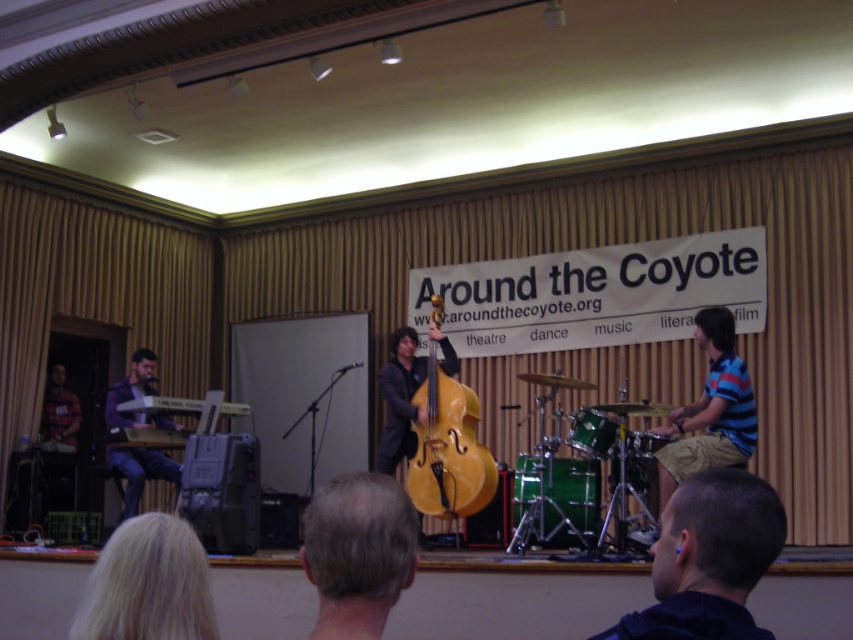
Question: Does dark blue hoodie at lower right come behind blue striped shirt at right?

Choices:
 (A) yes
 (B) no

Answer: (B)

Question: Is dark blue hoodie at lower right above blue striped shirt at right?

Choices:
 (A) no
 (B) yes

Answer: (B)

Question: Which of the following is the closest to the observer?

Choices:
 (A) matte purple keyboard at left
 (B) blue striped shirt at right
 (C) dark blue hoodie at lower right

Answer: (C)

Question: Based on their relative distances, which object is farther from the golden polished wood cello at center?

Choices:
 (A) blue striped shirt at right
 (B) matte purple keyboard at left

Answer: (B)

Question: Which point is closer to the camera?

Choices:
 (A) matte purple keyboard at left
 (B) golden polished wood cello at center
 (C) blue striped shirt at right
 (D) dark blue hoodie at lower right

Answer: (D)

Question: Does blue striped shirt at right appear on the right side of golden polished wood cello at center?

Choices:
 (A) no
 (B) yes

Answer: (B)